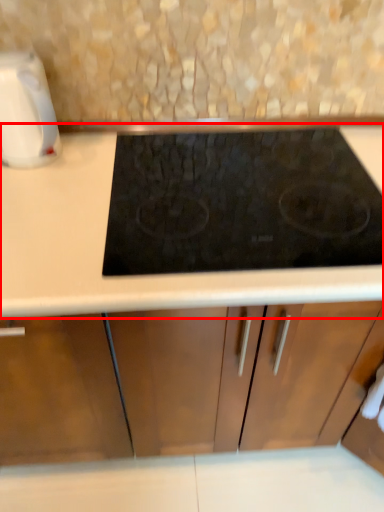
Question: From the image's perspective, what is the correct spatial relationship of countertop (annotated by the red box) in relation to kitchen appliance?

Choices:
 (A) below
 (B) above

Answer: (A)